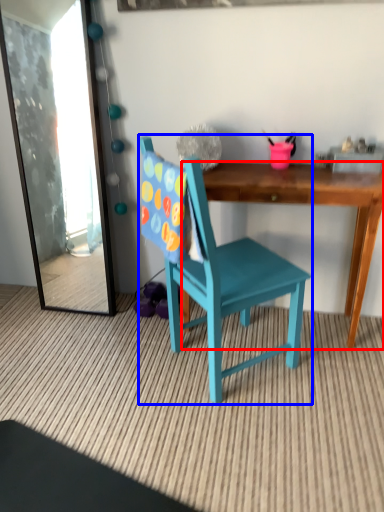
Question: Which point is further to the camera, desk (highlighted by a red box) or chair (highlighted by a blue box)?

Choices:
 (A) desk
 (B) chair

Answer: (A)